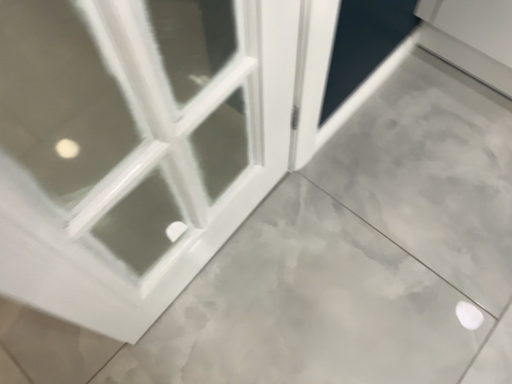
Question: Is white glossy screen door at upper right in front of or behind white glossy door at upper left in the image?

Choices:
 (A) front
 (B) behind

Answer: (B)

Question: From the image's perspective, relative to white glossy door at upper left, is white glossy screen door at upper right above or below?

Choices:
 (A) above
 (B) below

Answer: (A)

Question: In terms of width, does white glossy screen door at upper right look wider or thinner when compared to white glossy door at upper left?

Choices:
 (A) thin
 (B) wide

Answer: (A)

Question: From a real-world perspective, is white glossy door at upper left physically located above or below white glossy screen door at upper right?

Choices:
 (A) below
 (B) above

Answer: (A)

Question: Does point (97, 218) appear closer or farther from the camera than point (315, 14)?

Choices:
 (A) closer
 (B) farther

Answer: (A)

Question: Based on their sizes in the image, would you say white glossy door at upper left is bigger or smaller than white glossy screen door at upper right?

Choices:
 (A) big
 (B) small

Answer: (A)

Question: Do you think white glossy door at upper left is within white glossy screen door at upper right, or outside of it?

Choices:
 (A) outside
 (B) inside

Answer: (A)